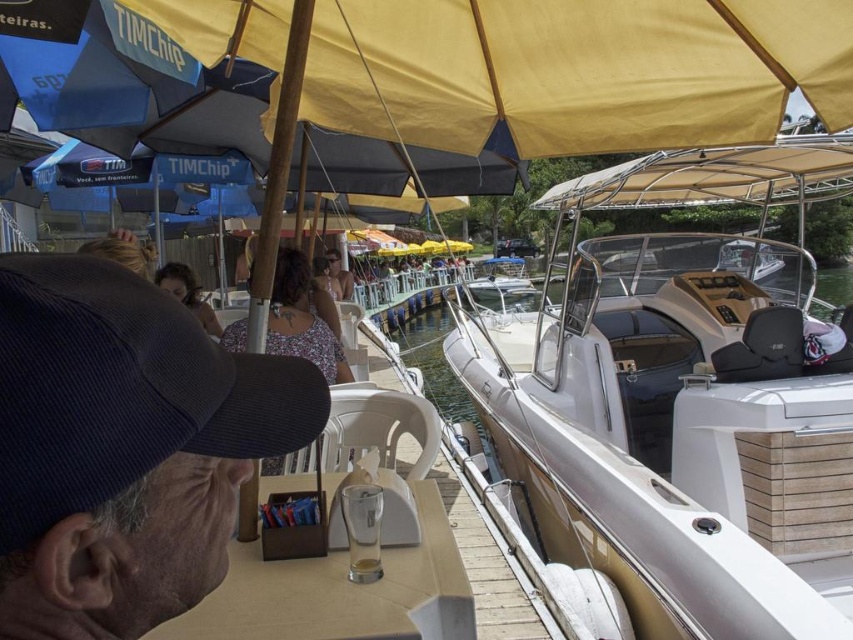
Question: Which is farther from the white glossy boat at center?

Choices:
 (A) floral fabric dress at center
 (B) dark brown hair at center

Answer: (B)

Question: Which object is positioned farthest from the floral fabric dress at center?

Choices:
 (A) dark brown hair at center
 (B) white glossy boat at center

Answer: (B)

Question: Based on their relative distances, which object is nearer to the floral fabric dress at center?

Choices:
 (A) dark blue corduroy baseball cap at upper left
 (B) dark brown hair at center
 (C) white glossy boat at center

Answer: (A)

Question: Does white glossy boat at center appear on the left side of dark blue corduroy baseball cap at upper left?

Choices:
 (A) no
 (B) yes

Answer: (A)

Question: Does floral fabric dress at center have a smaller size compared to dark brown hair at center?

Choices:
 (A) no
 (B) yes

Answer: (A)

Question: Does white glossy boat at center have a greater width compared to floral fabric dress at center?

Choices:
 (A) yes
 (B) no

Answer: (A)